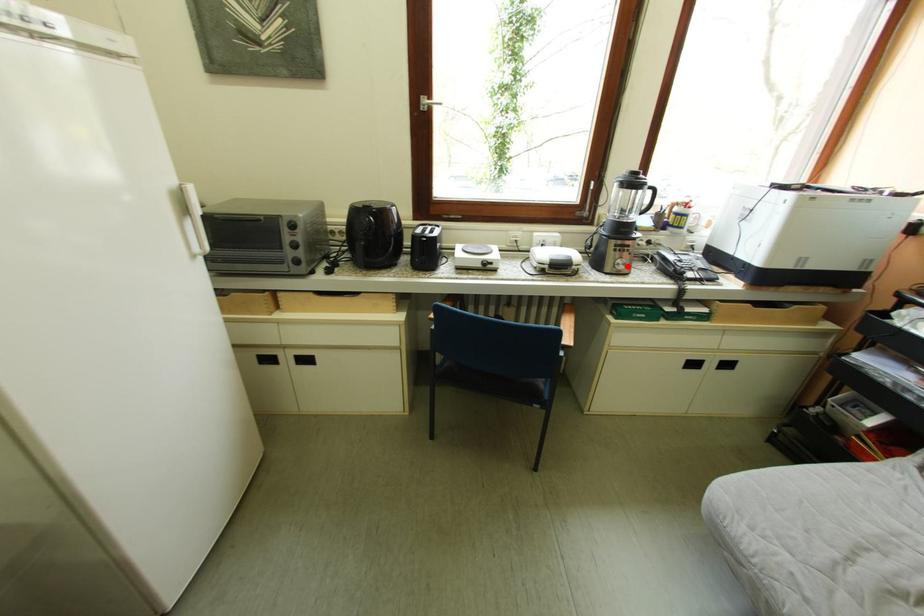
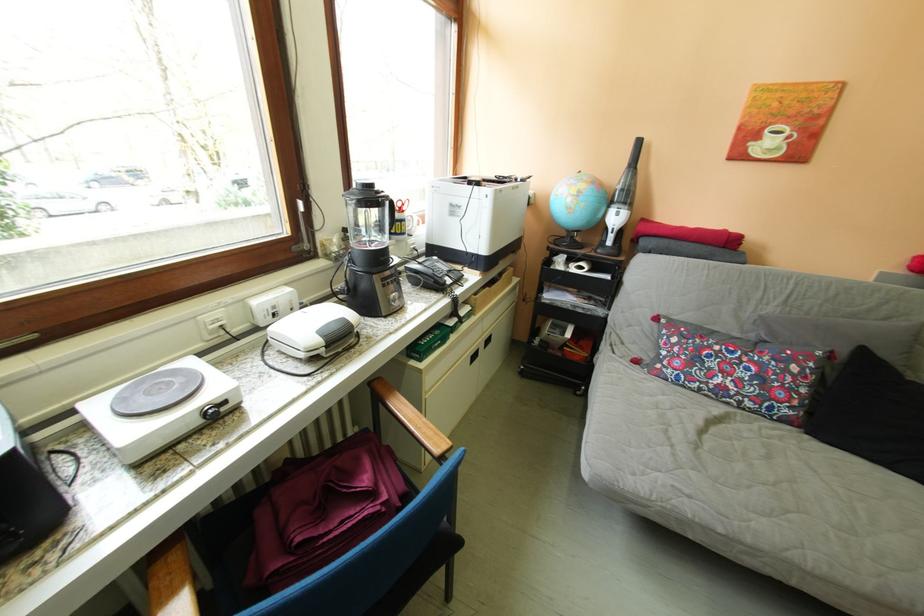
Where in the second image is the point corresponding to the highlighted location from the first image?

(402, 304)